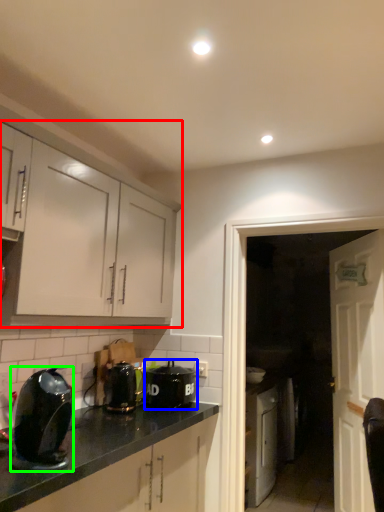
Question: Which object is the farthest from cabinetry (highlighted by a red box)? Choose among these: kitchen appliance (highlighted by a blue box) or kitchen appliance (highlighted by a green box).

Choices:
 (A) kitchen appliance
 (B) kitchen appliance

Answer: (A)